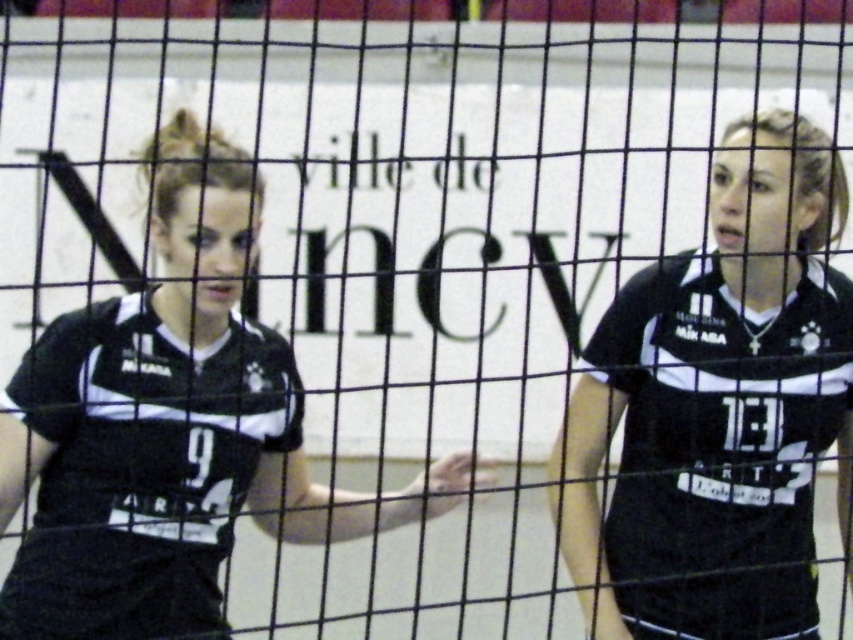
You are a photographer trying to capture a closeup of the numbers on both jerseys. Since both black matte jersey at center and matte black jersey at center are in the frame, which one do you need to zoom in on less to read the number?

The black matte jersey at center has a lesser width compared to matte black jersey at center, so you need to zoom in less on the matte black jersey at center to read its number because it is wider.